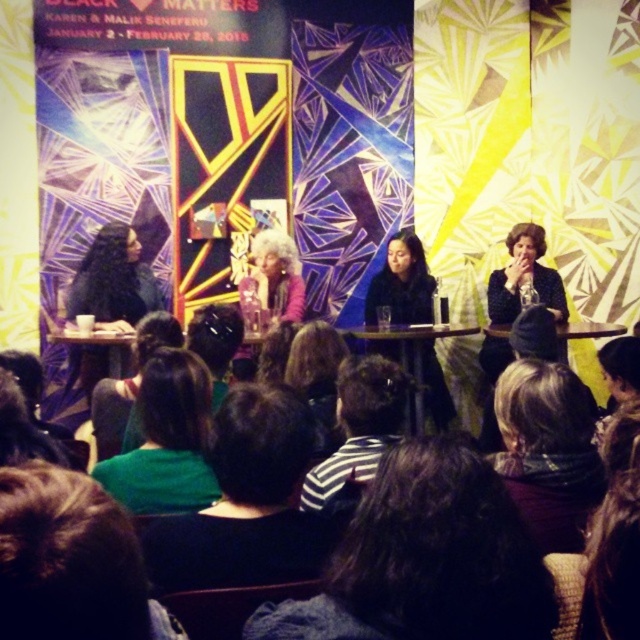
You are attending a panel discussion and notice two people sitting behind the table. One is wearing a green fabric shirt at lower center and the other a matte black jacket at center. From your perspective, which one is sitting to the left of the other?

The green fabric shirt at lower center is positioned on the left side of matte black jacket at center.

You are organizing a photo shoot and need to position a spotlight on the green fabric at lower left and the matte black jacket at left. Based on their positions, which object should you place the spotlight closer to the left side of the stage?

The matte black jacket at left should be closer to the left side of the stage because the green fabric at lower left is positioned to its right.

You are organizing a photo shoot and need to ensure that all items in the scene are visible in the final image. Given that the green fabric at lower left and the matte black jacket at left are both important elements, which one might require more careful positioning to avoid being obscured due to its size?

The green fabric at lower left has a smaller size compared to the matte black jacket at left, so it might require more careful positioning to avoid being obscured due to its smaller size.